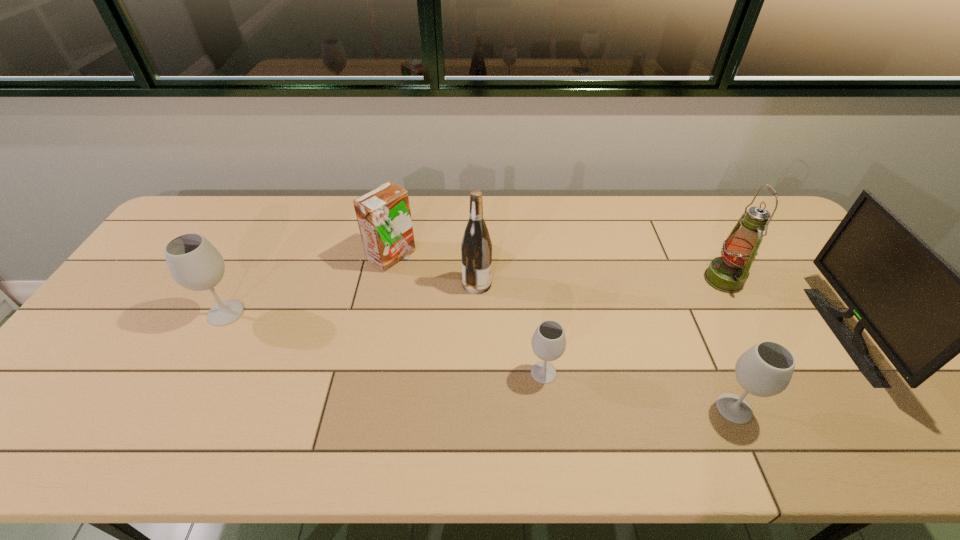
Locate an element on the screen. This screenshot has height=540, width=960. free region located 0.170m on the back of the leftmost object is located at coordinates (255, 258).

Where is `free space located 0.090m on the back of the second wineglass from right to left`? This screenshot has height=540, width=960. free space located 0.090m on the back of the second wineglass from right to left is located at coordinates tap(539, 332).

The image size is (960, 540). Identify the location of free space located 0.100m on the back of the third object from right to left. coord(710,355).

Image resolution: width=960 pixels, height=540 pixels. I want to click on free space located 0.190m on the right of the fifth object from right to left, so click(555, 284).

Find the location of a particular element. vacant space situated 0.230m on the front of the oil lamp is located at coordinates click(771, 366).

Identify the location of free point located on the straw side of the carton. The width and height of the screenshot is (960, 540). pos(540,256).

This screenshot has height=540, width=960. Identify the location of blank space located on the front-facing side of the monitor. (770, 333).

The height and width of the screenshot is (540, 960). I want to click on vacant space located 0.170m on the front-facing side of the monitor, so click(x=770, y=333).

This screenshot has width=960, height=540. Identify the location of vacant space situated on the front-facing side of the monitor. (710, 333).

Identify the location of monitor that is at the near edge. The image size is (960, 540). (921, 312).